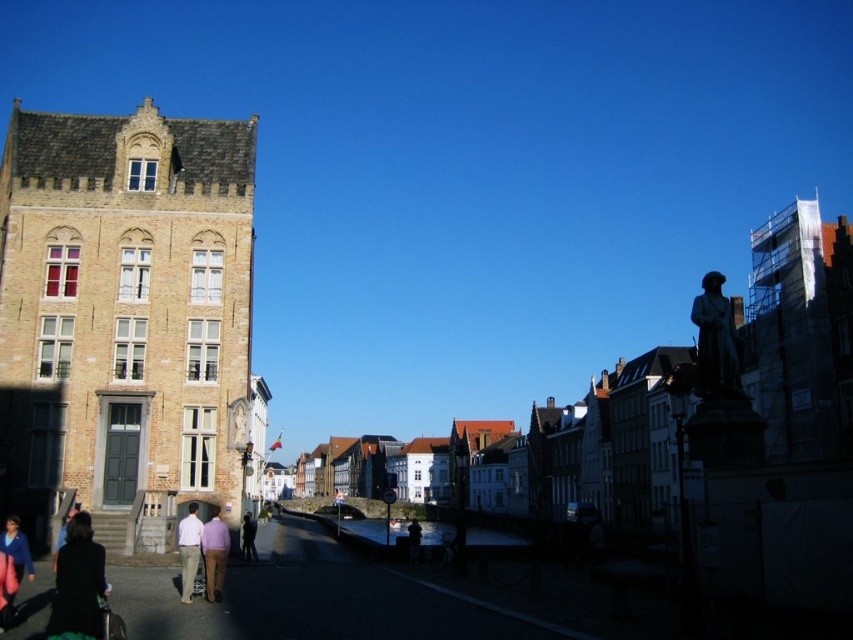
Question: Which of these objects is positioned closest to the light pink shirt at lower left?

Choices:
 (A) bronze statue at right
 (B) brick building at left
 (C) dark brown leather jacket at center

Answer: (B)

Question: Which object appears farthest from the camera in this image?

Choices:
 (A) bronze statue at right
 (B) dark brown leather jacket at center

Answer: (B)

Question: Is blue fabric jacket at lower left to the right of dark brown leather jacket at center from the viewer's perspective?

Choices:
 (A) yes
 (B) no

Answer: (B)

Question: Can you confirm if brick building at left is positioned to the left of light pink shirt at center?

Choices:
 (A) no
 (B) yes

Answer: (B)

Question: Observing the image, what is the correct spatial positioning of dark brown leather jacket at lower left in reference to dark gray fabric jacket at center?

Choices:
 (A) left
 (B) right

Answer: (A)

Question: Estimate the real-world distances between objects in this image. Which object is farther from the brick building at left?

Choices:
 (A) light pink shirt at lower left
 (B) dark brown leather jacket at lower left
 (C) light pink shirt at center
 (D) dark gray fabric jacket at center

Answer: (C)